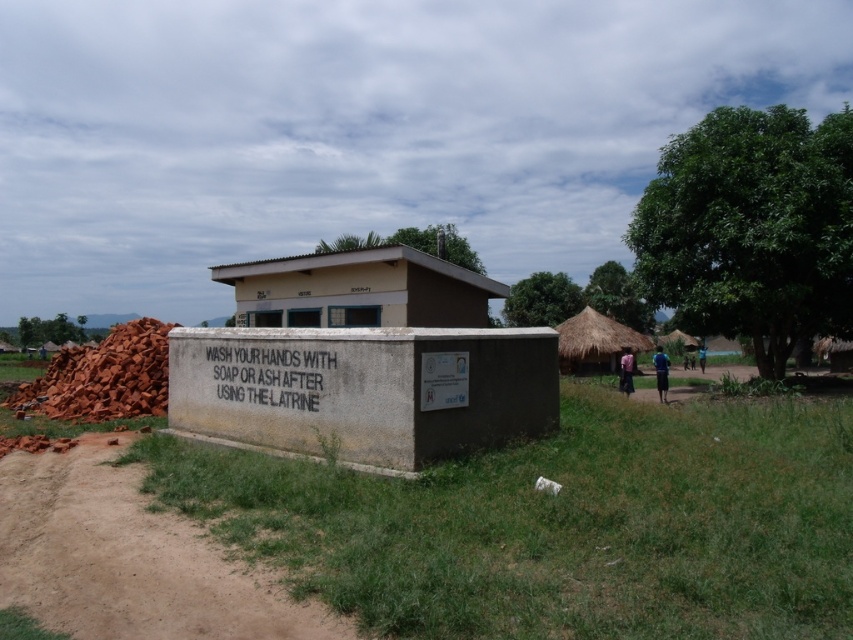
You are a construction worker carrying a heavy tool box. You need to walk from the latrine to the brown dirt field at lower left. The brown dirt track at lower left is a path that might be easier to walk on. Is the distance between the brown dirt field and the track too far for you to carry your tools comfortably?

The distance between the brown dirt field at lower left and the brown dirt track at lower left is 5.48 meters. This distance may be manageable for a construction worker carrying a tool box, but it depends on the worker and the weight of the tools. However, the question does not provide information about the worker or tool weight, so we can only confirm the distance is 5.48 meters.